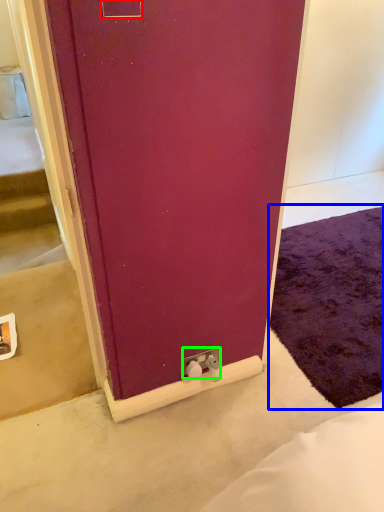
Question: Which object is the farthest from electric outlet (highlighted by a red box)? Choose among these: doormat (highlighted by a blue box) or electric outlet (highlighted by a green box).

Choices:
 (A) doormat
 (B) electric outlet

Answer: (A)